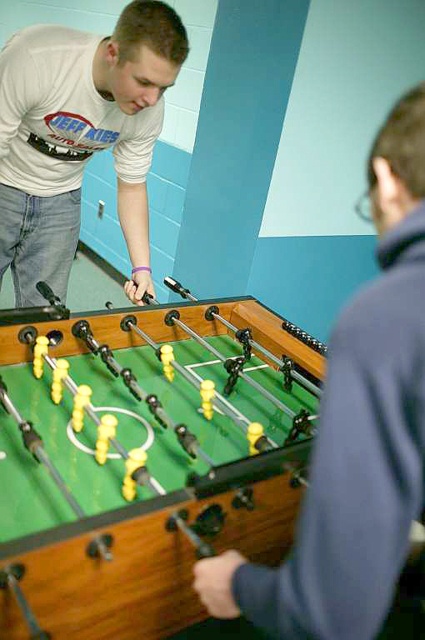
Question: Which of the following is the closest to the observer?

Choices:
 (A) (2, 230)
 (B) (274, 548)

Answer: (B)

Question: Is green wooden foosball table at center below matte green foosball table at center?

Choices:
 (A) no
 (B) yes

Answer: (A)

Question: Which of the following is the closest to the observer?

Choices:
 (A) (82, 157)
 (B) (206, 604)

Answer: (B)

Question: Can you confirm if matte green foosball table at center is bigger than matte white t-shirt at upper left?

Choices:
 (A) no
 (B) yes

Answer: (A)

Question: Which object is positioned closest to the matte white t-shirt at upper left?

Choices:
 (A) green wooden foosball table at center
 (B) matte green foosball table at center

Answer: (A)

Question: Observing the image, what is the correct spatial positioning of matte green foosball table at center in reference to matte white t-shirt at upper left?

Choices:
 (A) left
 (B) right

Answer: (B)